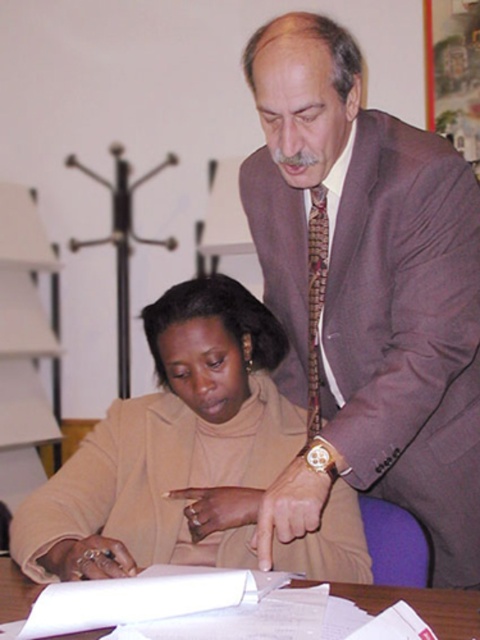
In the scene shown: Can you confirm if brown suit at upper right is taller than white paper at center?

Yes.

How far apart are brown suit at upper right and white paper at center?

They are 21.35 inches apart.

Where is `brown suit at upper right`? The image size is (480, 640). brown suit at upper right is located at coordinates (370, 282).

The image size is (480, 640). I want to click on brown suit at upper right, so click(x=370, y=282).

Between beige fabric jacket at lower left and white paper at center, which one has more height?

beige fabric jacket at lower left

Is point (282, 449) positioned in front of point (27, 582)?

No.

Identify the location of beige fabric jacket at lower left. Image resolution: width=480 pixels, height=640 pixels. (172, 449).

Describe the element at coordinates (370, 282) in the screenshot. I see `brown suit at upper right` at that location.

Who is more distant from viewer, (307, 209) or (137, 522)?

Positioned behind is point (137, 522).

Locate an element on the screen. This screenshot has width=480, height=640. brown suit at upper right is located at coordinates (370, 282).